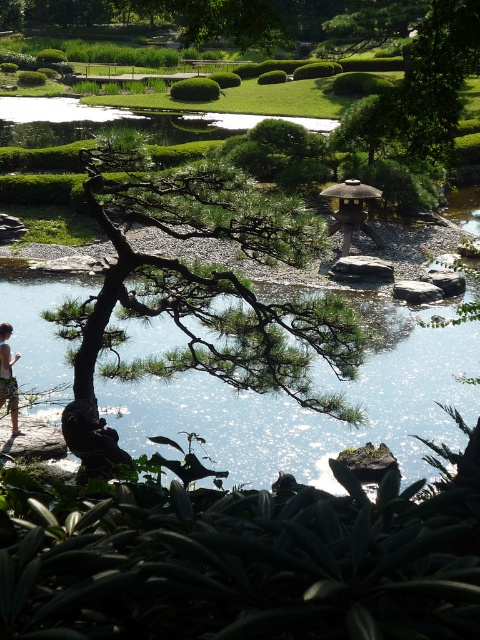
Question: Which object appears farthest from the camera in this image?

Choices:
 (A) light brown wooden stick at lower left
 (B) clear water at center

Answer: (A)

Question: Can you confirm if green matte tree at center is smaller than clear water at center?

Choices:
 (A) yes
 (B) no

Answer: (B)

Question: Which of the following is the closest to the observer?

Choices:
 (A) clear water at center
 (B) green matte tree at center
 (C) light brown wooden stick at lower left

Answer: (B)

Question: Can you confirm if green matte tree at center is thinner than light brown wooden stick at lower left?

Choices:
 (A) yes
 (B) no

Answer: (B)

Question: Can you confirm if green matte tree at center is positioned below clear water at center?

Choices:
 (A) yes
 (B) no

Answer: (B)

Question: Among these objects, which one is farthest from the camera?

Choices:
 (A) light brown wooden stick at lower left
 (B) clear water at center
 (C) green matte tree at center

Answer: (A)